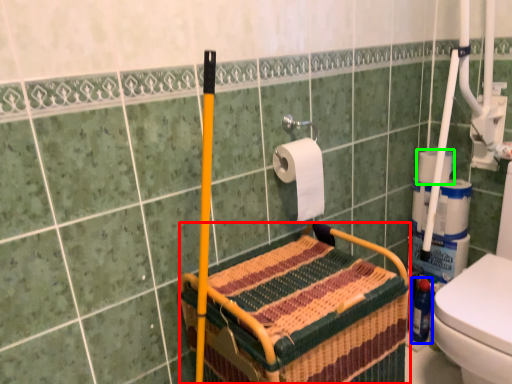
Question: Based on their relative distances, which object is nearer to crate (highlighted by a red box)? Choose from bottle (highlighted by a blue box) and toilet paper (highlighted by a green box).

Choices:
 (A) bottle
 (B) toilet paper

Answer: (B)